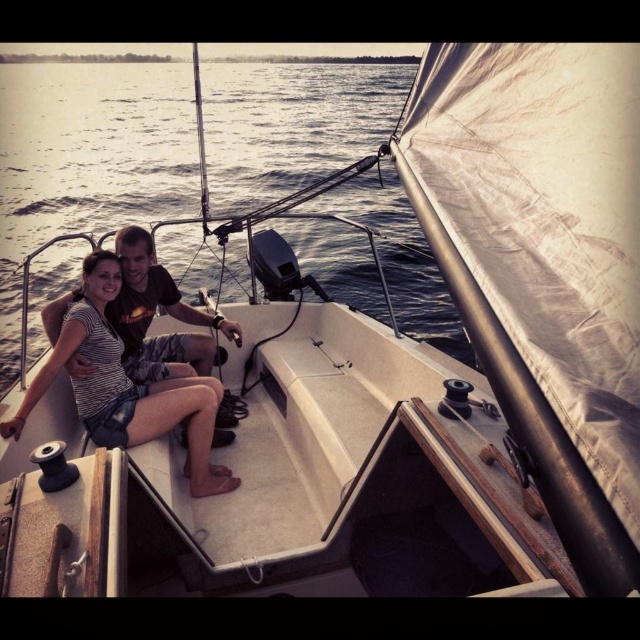
Question: Which of these objects is positioned closest to the blue water at center?

Choices:
 (A) matte black shirt at center
 (B) striped fabric dress at center

Answer: (B)

Question: Which object appears farthest from the camera in this image?

Choices:
 (A) matte black shirt at center
 (B) blue water at center

Answer: (B)

Question: From the image, what is the correct spatial relationship of blue water at center in relation to striped fabric dress at center?

Choices:
 (A) below
 (B) above

Answer: (B)

Question: Where is striped fabric dress at center located in relation to matte black shirt at center in the image?

Choices:
 (A) below
 (B) above

Answer: (A)

Question: Considering the relative positions of blue water at center and matte black shirt at center in the image provided, where is blue water at center located with respect to matte black shirt at center?

Choices:
 (A) right
 (B) left

Answer: (B)

Question: Which of these objects is positioned closest to the striped fabric dress at center?

Choices:
 (A) blue water at center
 (B) matte black shirt at center

Answer: (B)